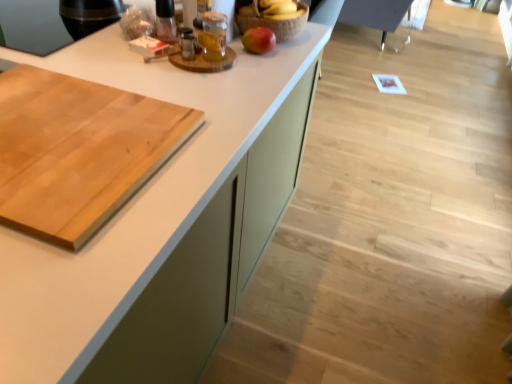
Where is `empty space that is ontop of white matte countertop at center (from a real-world perspective)`? This screenshot has width=512, height=384. empty space that is ontop of white matte countertop at center (from a real-world perspective) is located at coordinates (132, 114).